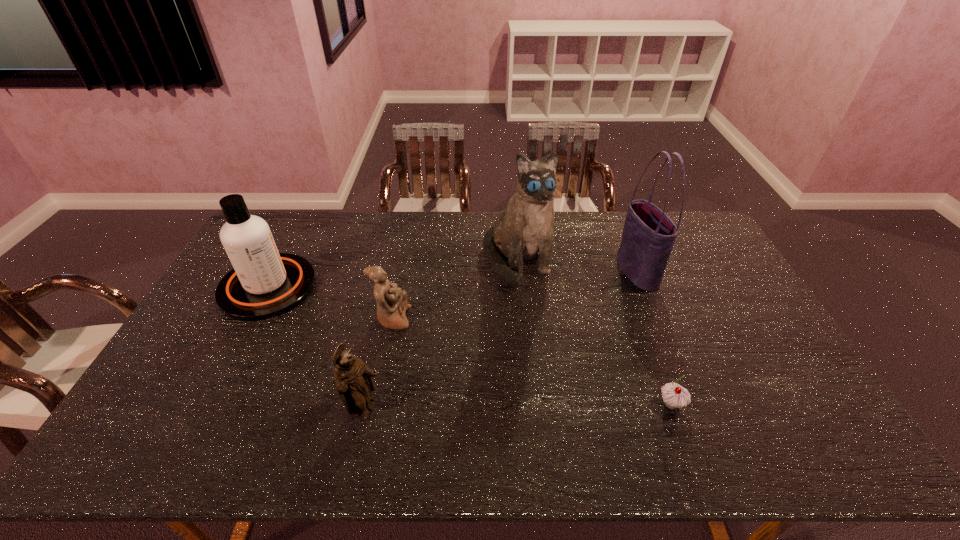
Identify the location of vacant space that satisfies the following two spatial constraints: 1. at the face of the tote bag; 2. on the left side of the fourth object from left to right. (519, 272).

Locate an element on the screen. Image resolution: width=960 pixels, height=540 pixels. vacant area that satisfies the following two spatial constraints: 1. on the front side of the cupcake; 2. on the front-facing side of the nearer figurine is located at coordinates (673, 409).

The height and width of the screenshot is (540, 960). I want to click on free location that satisfies the following two spatial constraints: 1. at the face of the cupcake; 2. on the right side of the cat, so click(x=532, y=404).

What are the coordinates of `free spot that satisfies the following two spatial constraints: 1. at the face of the third object from right to left; 2. on the front-facing side of the farther figurine` in the screenshot? It's located at (523, 319).

The height and width of the screenshot is (540, 960). Find the location of `vacant area in the image that satisfies the following two spatial constraints: 1. at the face of the cat; 2. on the right side of the tote bag`. vacant area in the image that satisfies the following two spatial constraints: 1. at the face of the cat; 2. on the right side of the tote bag is located at coordinates (519, 272).